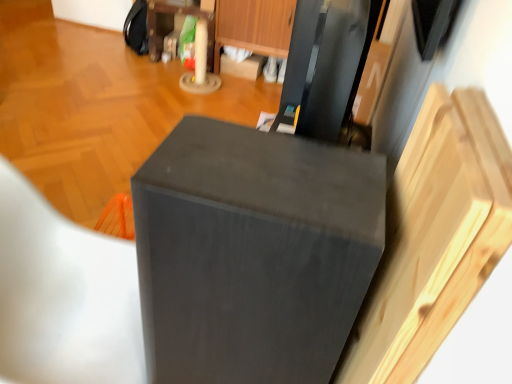
Question: Do you think matte black folding chair at lower left is within matte wood dresser at upper center, or outside of it?

Choices:
 (A) outside
 (B) inside

Answer: (A)

Question: Is matte black folding chair at lower left bigger or smaller than matte wood dresser at upper center?

Choices:
 (A) big
 (B) small

Answer: (A)

Question: Which object is positioned closest to the matte black folding chair at lower left?

Choices:
 (A) matte black speaker at center
 (B) matte wood dresser at upper center
 (C) wooden drawer at upper center

Answer: (A)

Question: Estimate the real-world distances between objects in this image. Which object is closer to the matte black folding chair at lower left?

Choices:
 (A) matte wood dresser at upper center
 (B) wooden drawer at upper center
 (C) matte black speaker at center

Answer: (C)